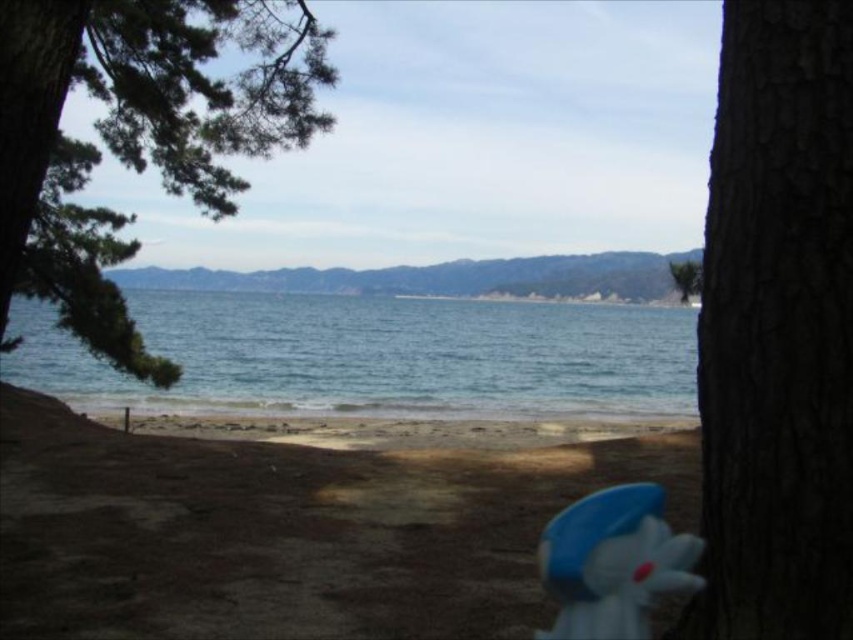
Question: Observing the image, what is the correct spatial positioning of brown rough bark tree at right in reference to green matte tree at upper center?

Choices:
 (A) above
 (B) below

Answer: (B)

Question: Which point is farther to the camera?

Choices:
 (A) (744, 340)
 (B) (99, 353)
 (C) (651, 403)
 (D) (572, 566)

Answer: (C)

Question: Which of these objects is positioned farthest from the green matte tree at upper center?

Choices:
 (A) green textured pine branch at upper left
 (B) blue water at center
 (C) brown rough bark tree at right
 (D) blue rubber duck at lower right

Answer: (B)

Question: Is brown rough bark tree at right above blue rubber duck at lower right?

Choices:
 (A) no
 (B) yes

Answer: (B)

Question: In this image, where is blue rubber duck at lower right located relative to green matte tree at upper center?

Choices:
 (A) above
 (B) below

Answer: (B)

Question: Which of the following is the farthest from the observer?

Choices:
 (A) brown rough bark tree at right
 (B) blue rubber duck at lower right
 (C) green matte tree at upper center

Answer: (C)